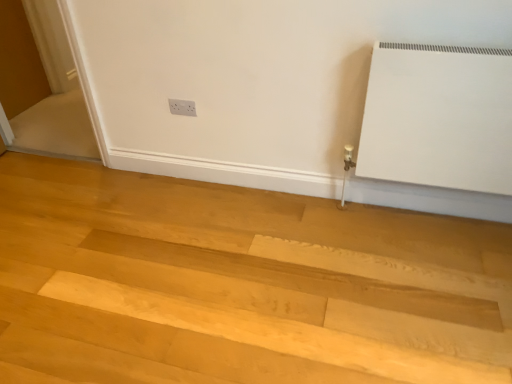
Question: Can you confirm if white plastic electric outlet at upper center is wider than natural wood floor at lower center?

Choices:
 (A) no
 (B) yes

Answer: (A)

Question: Considering the relative positions of white plastic electric outlet at upper center and natural wood floor at lower center in the image provided, is white plastic electric outlet at upper center to the right of natural wood floor at lower center from the viewer's perspective?

Choices:
 (A) no
 (B) yes

Answer: (B)

Question: Is white plastic electric outlet at upper center taller than natural wood floor at lower center?

Choices:
 (A) yes
 (B) no

Answer: (A)

Question: Does white plastic electric outlet at upper center come in front of natural wood floor at lower center?

Choices:
 (A) no
 (B) yes

Answer: (A)

Question: Is white plastic electric outlet at upper center smaller than natural wood floor at lower center?

Choices:
 (A) yes
 (B) no

Answer: (A)

Question: Is white plastic electric outlet at upper center not near natural wood floor at lower center?

Choices:
 (A) no
 (B) yes

Answer: (B)

Question: Is white glossy screen door at left shorter than white plastic electric outlet at upper center?

Choices:
 (A) no
 (B) yes

Answer: (A)

Question: Can you confirm if white glossy screen door at left is positioned to the left of white plastic electric outlet at upper center?

Choices:
 (A) yes
 (B) no

Answer: (A)

Question: From the image's perspective, is white glossy screen door at left below white plastic electric outlet at upper center?

Choices:
 (A) no
 (B) yes

Answer: (A)

Question: Can you confirm if white glossy screen door at left is thinner than white plastic electric outlet at upper center?

Choices:
 (A) yes
 (B) no

Answer: (B)

Question: From a real-world perspective, does white glossy screen door at left stand above white plastic electric outlet at upper center?

Choices:
 (A) yes
 (B) no

Answer: (A)

Question: Is white glossy screen door at left further to the viewer compared to white plastic electric outlet at upper center?

Choices:
 (A) yes
 (B) no

Answer: (B)

Question: Does natural wood floor at lower center have a greater height compared to white glossy screen door at left?

Choices:
 (A) yes
 (B) no

Answer: (B)